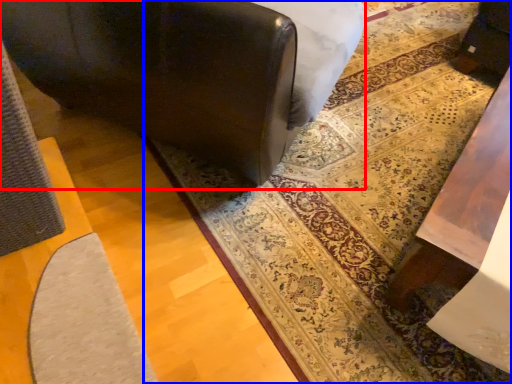
Question: Among these objects, which one is nearest to the camera, furniture (highlighted by a red box) or mat (highlighted by a blue box)?

Choices:
 (A) furniture
 (B) mat

Answer: (A)